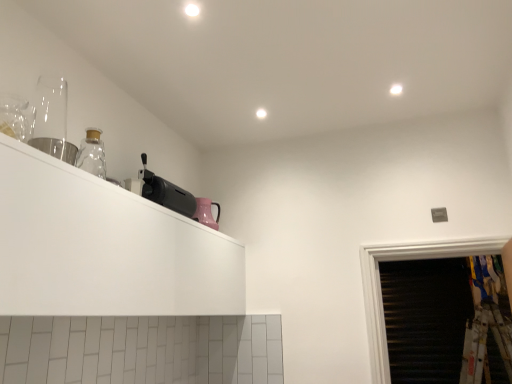
Question: Is black plastic toaster at upper left, the 2th appliance viewed from the right, at the left side of white matte cabinet at upper left?

Choices:
 (A) yes
 (B) no

Answer: (B)

Question: Is black plastic toaster at upper left, the 2th appliance viewed from the right, at the right side of white matte cabinet at upper left?

Choices:
 (A) no
 (B) yes

Answer: (B)

Question: Does black plastic toaster at upper left, the 2th appliance viewed from the right, have a larger size compared to white matte cabinet at upper left?

Choices:
 (A) yes
 (B) no

Answer: (B)

Question: From the image's perspective, is black plastic toaster at upper left, which ranks as the 2th appliance in left-to-right order, above white matte cabinet at upper left?

Choices:
 (A) no
 (B) yes

Answer: (B)

Question: From a real-world perspective, is black plastic toaster at upper left, the 2th appliance viewed from the right, physically below white matte cabinet at upper left?

Choices:
 (A) no
 (B) yes

Answer: (A)

Question: Considering the positions of pink glossy kettle at upper center, the third appliance from the front, and white matte cabinet at upper left in the image, is pink glossy kettle at upper center, the third appliance from the front, wider or thinner than white matte cabinet at upper left?

Choices:
 (A) wide
 (B) thin

Answer: (B)

Question: Would you say pink glossy kettle at upper center, the 3th appliance when ordered from left to right, is inside or outside white matte cabinet at upper left?

Choices:
 (A) inside
 (B) outside

Answer: (B)

Question: Looking at the image, does pink glossy kettle at upper center, the 3th appliance when ordered from left to right, seem bigger or smaller compared to white matte cabinet at upper left?

Choices:
 (A) small
 (B) big

Answer: (A)

Question: Is pink glossy kettle at upper center, which ranks as the 1th appliance in right-to-left order, in front of or behind white matte cabinet at upper left in the image?

Choices:
 (A) front
 (B) behind

Answer: (B)

Question: Based on their sizes in the image, would you say black plastic toaster at upper left, the 2th appliance viewed from the right, is bigger or smaller than white matte cabinet at upper left?

Choices:
 (A) big
 (B) small

Answer: (B)

Question: Does point (153, 175) appear closer or farther from the camera than point (148, 274)?

Choices:
 (A) farther
 (B) closer

Answer: (A)

Question: Considering the positions of black plastic toaster at upper left, the second appliance positioned from the back, and white matte cabinet at upper left in the image, is black plastic toaster at upper left, the second appliance positioned from the back, wider or thinner than white matte cabinet at upper left?

Choices:
 (A) wide
 (B) thin

Answer: (B)

Question: From the image's perspective, relative to white matte cabinet at upper left, is black plastic toaster at upper left, the second appliance positioned from the back, above or below?

Choices:
 (A) above
 (B) below

Answer: (A)

Question: Is point (164, 185) positioned closer to the camera than point (210, 225)?

Choices:
 (A) farther
 (B) closer

Answer: (B)

Question: From the image's perspective, is black plastic toaster at upper left, which ranks as the 2th appliance in left-to-right order, above or below pink glossy kettle at upper center, which ranks as the 1th appliance in right-to-left order?

Choices:
 (A) below
 (B) above

Answer: (B)